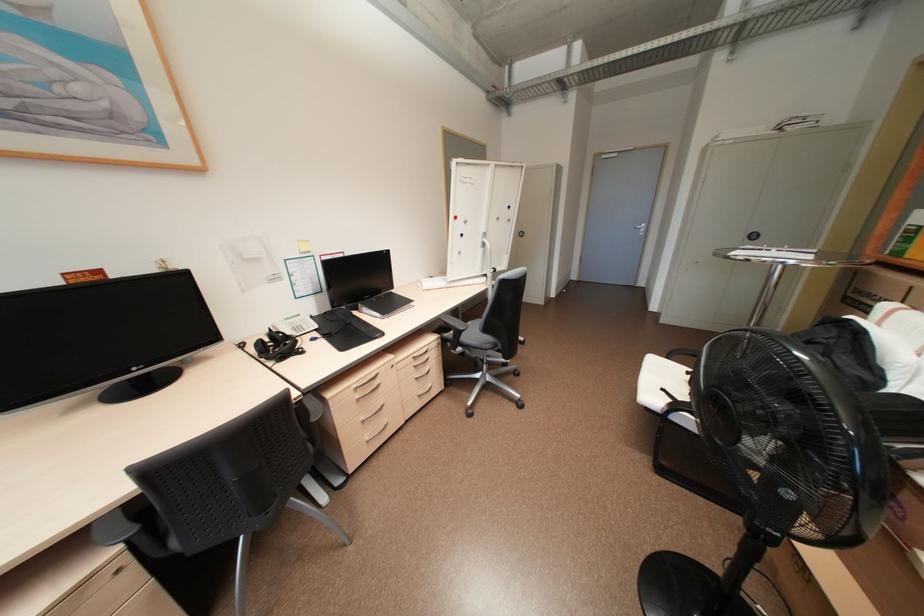
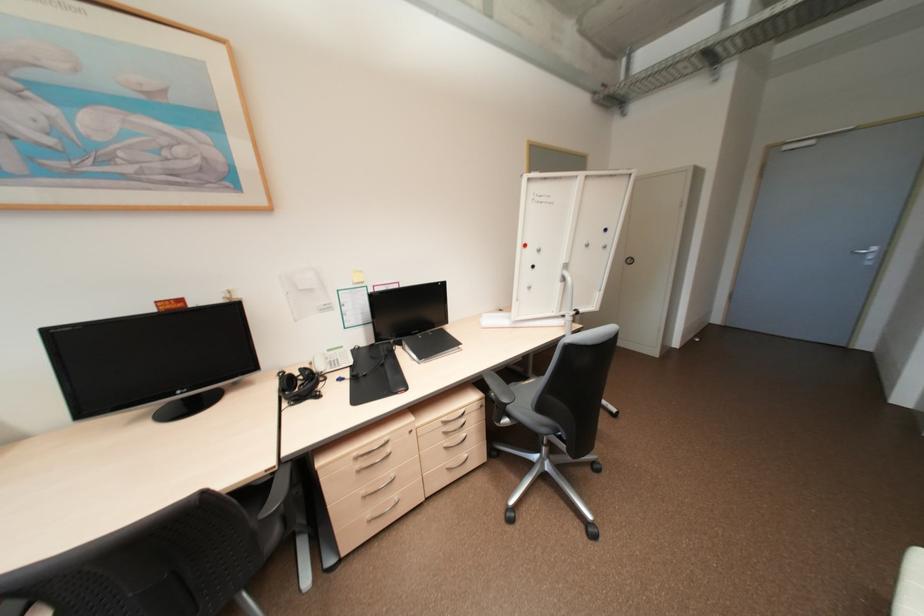
Find the pixel in the second image that matches the point at 265,342 in the first image.

(297, 377)